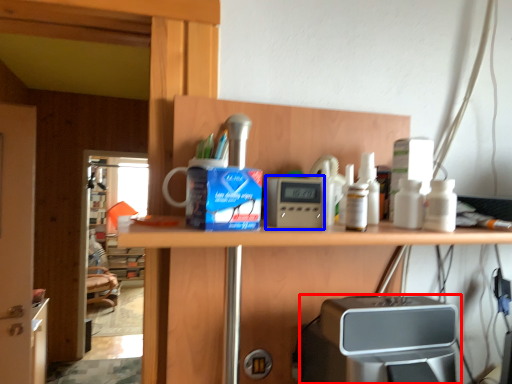
Question: Which object appears closest to the camera in this image, home appliance (highlighted by a red box) or appliance (highlighted by a blue box)?

Choices:
 (A) home appliance
 (B) appliance

Answer: (A)